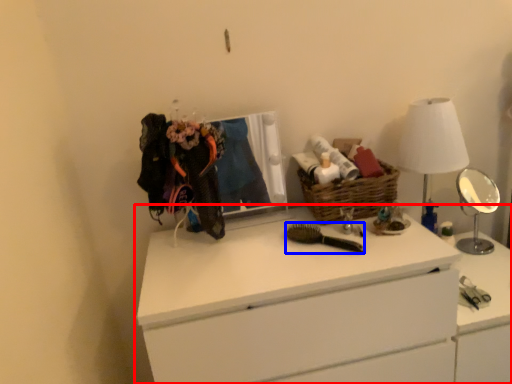
Question: Which object is further to the camera taking this photo, chest of drawers (highlighted by a red box) or brush (highlighted by a blue box)?

Choices:
 (A) chest of drawers
 (B) brush

Answer: (B)